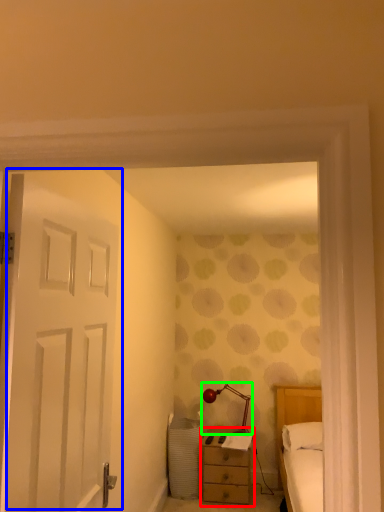
Question: Considering the real-world distances, which object is closest to nightstand (highlighted by a red box)? door (highlighted by a blue box) or table lamp (highlighted by a green box).

Choices:
 (A) door
 (B) table lamp

Answer: (B)